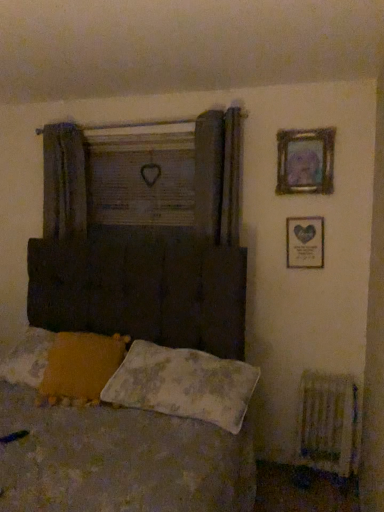
Question: Is the position of wooden frame at upper center more distant than that of fluffy white pillow at lower center, placed as the 1th pillow when sorted from right to left?

Choices:
 (A) no
 (B) yes

Answer: (B)

Question: Is wooden frame at upper center oriented away from fluffy white pillow at lower center, placed as the 1th pillow when sorted from right to left?

Choices:
 (A) yes
 (B) no

Answer: (B)

Question: From a real-world perspective, is wooden frame at upper center physically below fluffy white pillow at lower center, which is the second pillow from left to right?

Choices:
 (A) yes
 (B) no

Answer: (B)

Question: From the image's perspective, is wooden frame at upper center under fluffy white pillow at lower center, placed as the 1th pillow when sorted from right to left?

Choices:
 (A) yes
 (B) no

Answer: (B)

Question: Is wooden frame at upper center bigger than fluffy white pillow at lower center, which is the second pillow from left to right?

Choices:
 (A) no
 (B) yes

Answer: (A)

Question: Does wooden frame at upper center lie in front of fluffy white pillow at lower center, placed as the 1th pillow when sorted from right to left?

Choices:
 (A) no
 (B) yes

Answer: (A)

Question: Does yellow fabric pillow at lower left, which is the 2th pillow in right-to-left order, appear on the left side of textured fabric bed at center?

Choices:
 (A) no
 (B) yes

Answer: (A)

Question: Does yellow fabric pillow at lower left, which is the 2th pillow in right-to-left order, come in front of textured fabric bed at center?

Choices:
 (A) no
 (B) yes

Answer: (A)

Question: Considering the relative sizes of yellow fabric pillow at lower left, which is the 2th pillow in right-to-left order, and textured fabric bed at center in the image provided, is yellow fabric pillow at lower left, which is the 2th pillow in right-to-left order, wider than textured fabric bed at center?

Choices:
 (A) no
 (B) yes

Answer: (A)

Question: Is yellow fabric pillow at lower left, placed as the first pillow when sorted from left to right, aimed at textured fabric bed at center?

Choices:
 (A) yes
 (B) no

Answer: (A)

Question: From the image's perspective, does yellow fabric pillow at lower left, which is the 2th pillow in right-to-left order, appear lower than textured fabric bed at center?

Choices:
 (A) no
 (B) yes

Answer: (A)

Question: Is textured fabric bed at center at the back of yellow fabric pillow at lower left, which is the 2th pillow in right-to-left order?

Choices:
 (A) no
 (B) yes

Answer: (B)

Question: Is metallic silver picture frame at upper right, the first picture frame from the bottom, closer to the viewer compared to metallic gold picture frame at upper right, the second picture frame ordered from the bottom?

Choices:
 (A) yes
 (B) no

Answer: (B)